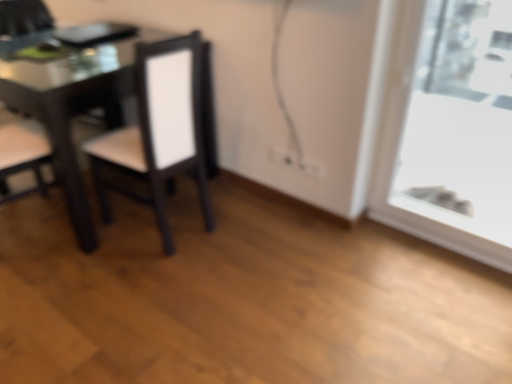
Question: Is matte black chair at left, the first chair from the left, positioned in front of transparent glass window at right?

Choices:
 (A) yes
 (B) no

Answer: (B)

Question: Is the surface of matte black chair at left, which is the 2th chair in right-to-left order, in direct contact with transparent glass window at right?

Choices:
 (A) yes
 (B) no

Answer: (B)

Question: From a real-world perspective, is matte black chair at left, the first chair from the left, under transparent glass window at right?

Choices:
 (A) no
 (B) yes

Answer: (A)

Question: Can you confirm if matte black chair at left, the first chair from the left, is thinner than transparent glass window at right?

Choices:
 (A) yes
 (B) no

Answer: (B)

Question: Is matte black chair at left, which is the 2th chair in right-to-left order, further to camera compared to transparent glass window at right?

Choices:
 (A) no
 (B) yes

Answer: (B)

Question: Based on their sizes in the image, would you say matte black chair at center, the first chair from the right, is bigger or smaller than matte black chair at left, which is the 2th chair in right-to-left order?

Choices:
 (A) big
 (B) small

Answer: (A)

Question: From their relative heights in the image, would you say matte black chair at center, the first chair from the right, is taller or shorter than matte black chair at left, which is the 2th chair in right-to-left order?

Choices:
 (A) tall
 (B) short

Answer: (A)

Question: Is point (98, 142) positioned closer to the camera than point (17, 41)?

Choices:
 (A) farther
 (B) closer

Answer: (B)

Question: Based on their positions, is matte black chair at center, which ranks as the 2th chair in left-to-right order, located to the left or right of matte black chair at left, the first chair from the left?

Choices:
 (A) left
 (B) right

Answer: (B)

Question: Would you say matte black chair at left, which is the 2th chair in right-to-left order, is inside or outside transparent glass window at right?

Choices:
 (A) inside
 (B) outside

Answer: (B)

Question: In the image, is matte black chair at left, which is the 2th chair in right-to-left order, on the left side or the right side of transparent glass window at right?

Choices:
 (A) left
 (B) right

Answer: (A)

Question: Based on their sizes in the image, would you say matte black chair at left, the first chair from the left, is bigger or smaller than transparent glass window at right?

Choices:
 (A) small
 (B) big

Answer: (B)

Question: From the image's perspective, is matte black chair at left, which is the 2th chair in right-to-left order, positioned above or below transparent glass window at right?

Choices:
 (A) above
 (B) below

Answer: (A)

Question: In terms of height, does matte black chair at center, which ranks as the 2th chair in left-to-right order, look taller or shorter compared to transparent glass window at right?

Choices:
 (A) short
 (B) tall

Answer: (A)

Question: Do you think matte black chair at center, the first chair from the right, is within transparent glass window at right, or outside of it?

Choices:
 (A) outside
 (B) inside

Answer: (A)